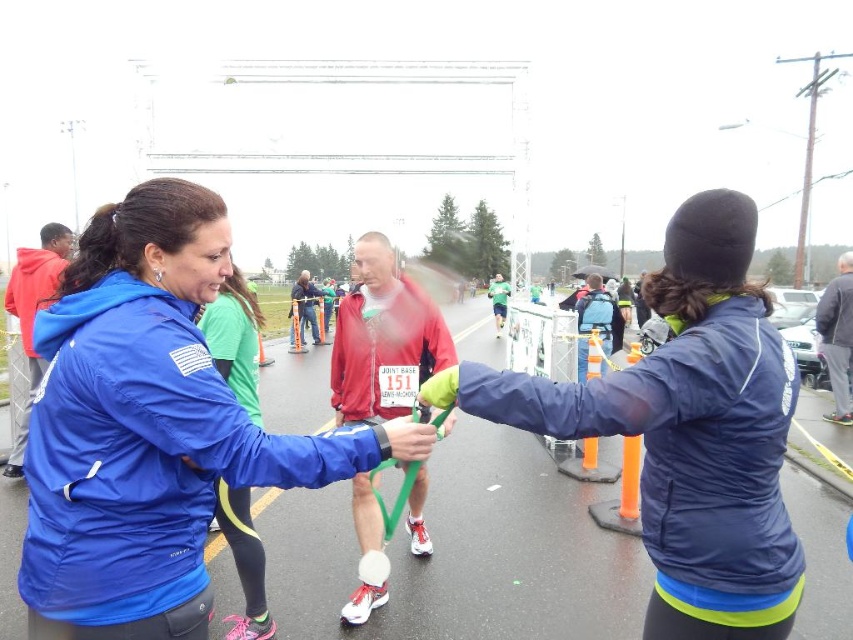
Question: Does blue matte jacket at center have a larger size compared to navy blue jacket at center?

Choices:
 (A) no
 (B) yes

Answer: (A)

Question: Does blue matte jacket at center appear on the left side of navy blue jacket at center?

Choices:
 (A) yes
 (B) no

Answer: (A)

Question: Does blue matte jacket at center have a larger size compared to navy blue jacket at center?

Choices:
 (A) yes
 (B) no

Answer: (B)